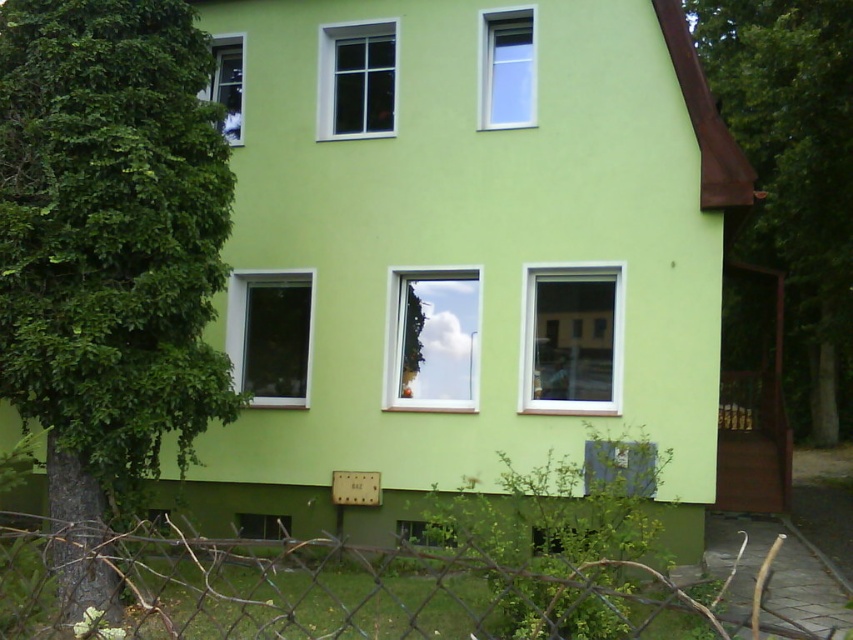
Can you confirm if metal wire mesh at lower center is taller than clear glass window at center?

Incorrect, metal wire mesh at lower center's height is not larger of clear glass window at center's.

Find the location of `metal wire mesh at lower center`. metal wire mesh at lower center is located at coordinates (343, 593).

Is point (329, 586) closer to viewer compared to point (300, 298)?

Yes, point (329, 586) is in front of point (300, 298).

This screenshot has width=853, height=640. Identify the location of metal wire mesh at lower center. (343, 593).

How much distance is there between green leafy tree at left and transparent glass window at upper left?

green leafy tree at left and transparent glass window at upper left are 13.56 feet apart.

Looking at this image, does green leafy tree at left have a larger size compared to transparent glass window at upper left?

Yes.

Is point (61, 180) positioned after point (229, 100)?

No, (61, 180) is in front of (229, 100).

Locate an element on the screen. This screenshot has width=853, height=640. green leafy tree at left is located at coordinates (108, 257).

Does transparent glass window at center have a larger size compared to white glass window at upper center?

Yes.

Is transparent glass window at center thinner than white glass window at upper center?

No.

Who is more distant from viewer, [459,323] or [393,54]?

Point [393,54]

Where is `transparent glass window at center`? This screenshot has height=640, width=853. transparent glass window at center is located at coordinates (432, 340).